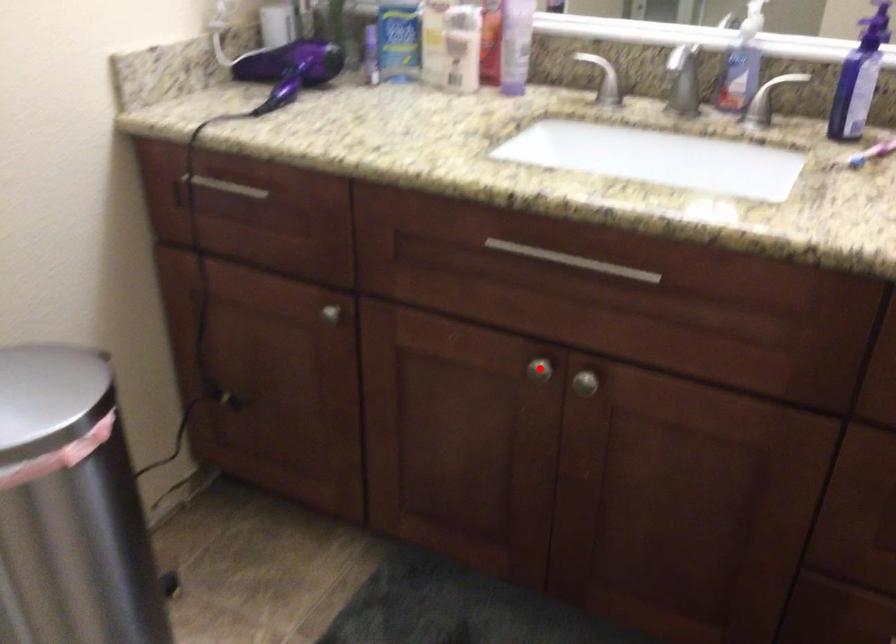
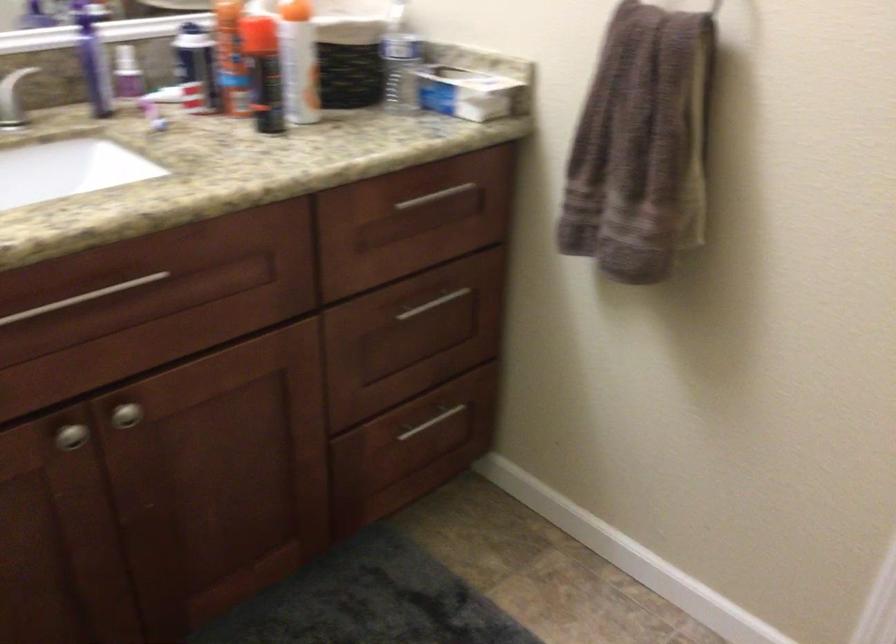
Locate, in the second image, the point that corresponds to the highlighted location in the first image.

(71, 436)